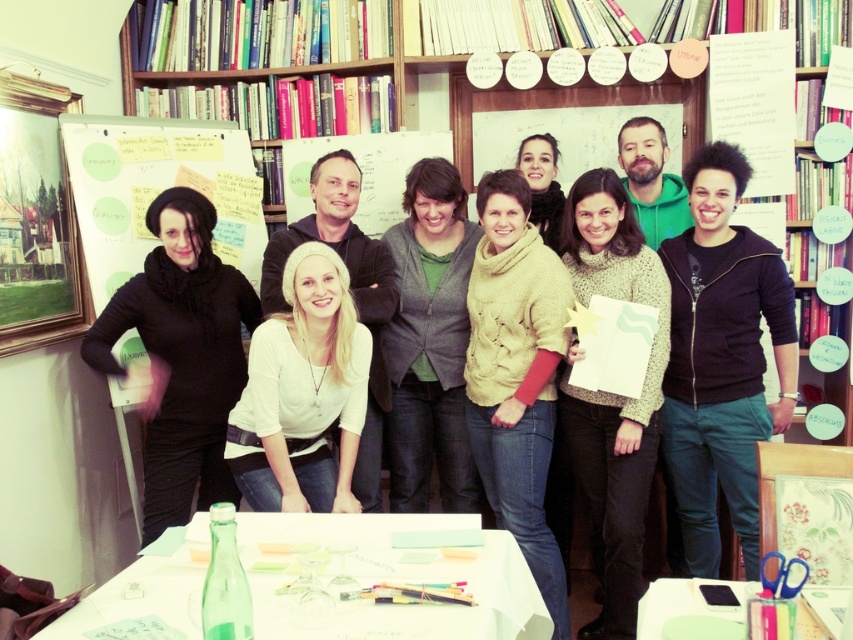
Question: Which object appears farthest from the camera in this image?

Choices:
 (A) knitted sweater at center
 (B) matte beige sweater at center
 (C) wooden bookcase at upper center
 (D) black zip-up hoodie at center-right

Answer: (C)

Question: Which is farther from the white matte sweater at center?

Choices:
 (A) green matte table at lower center
 (B) knitted beige sweater at center

Answer: (A)

Question: Is white paper table at center positioned before green matte table at lower center?

Choices:
 (A) no
 (B) yes

Answer: (A)

Question: Is wooden bookcase at upper center below knitted beige sweater at center?

Choices:
 (A) yes
 (B) no

Answer: (B)

Question: Which object is closer to the camera taking this photo?

Choices:
 (A) white paperboard at center
 (B) matte beige sweater at center
 (C) knitted sweater at center
 (D) green matte table at lower center

Answer: (D)

Question: Can you confirm if knitted beige sweater at center is positioned to the left of white paperboard at center?

Choices:
 (A) no
 (B) yes

Answer: (B)